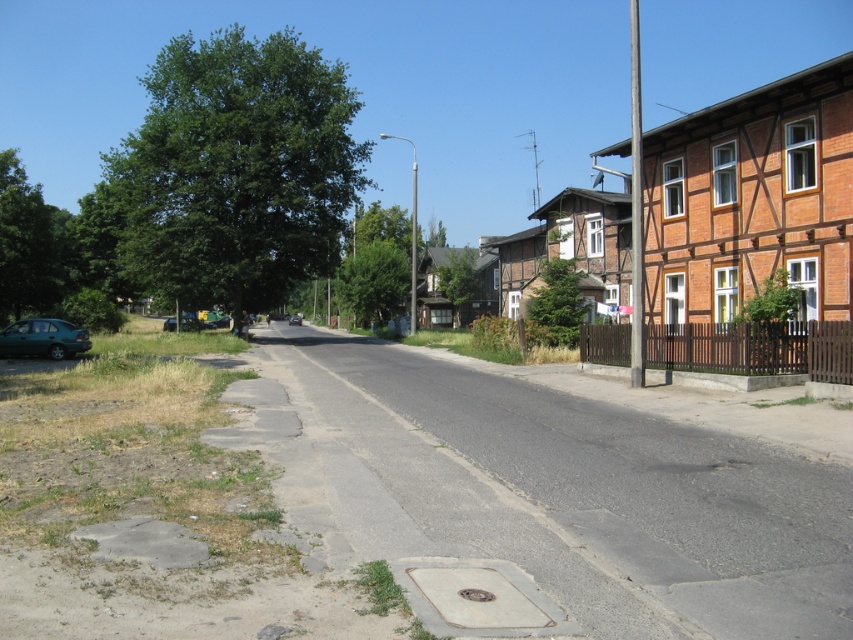
You are a pedestrian standing on the sidewalk next to the row of brick houses. You notice two metallic poles along the street. Which metallic pole is nearer to you, the metallic pole at right or the metallic pole at center?

The metallic pole at right is closer to the viewer than metallic pole at center, so the metallic pole at right is nearer to you.

You are a pedestrian standing at the intersection and want to cross the street to reach the row of brick houses. Which car, the teal matte car at lower left or the shiny black car at center, is closer to your starting position?

The teal matte car at lower left is closer to your starting position because it is positioned below the shiny black car at center, meaning it is nearer to the pedestrian at the intersection.

You are a delivery person with a 2.5 meter long cart. You need to travel from the metallic pole at right to the teal matte car at lower left along the road. Is there enough space for your cart to move straight without turning?

The distance between the metallic pole at right and the teal matte car at lower left is 26.37 meters. Since the cart is only 2.5 meters long, there is ample space for it to move straight without needing to turn.